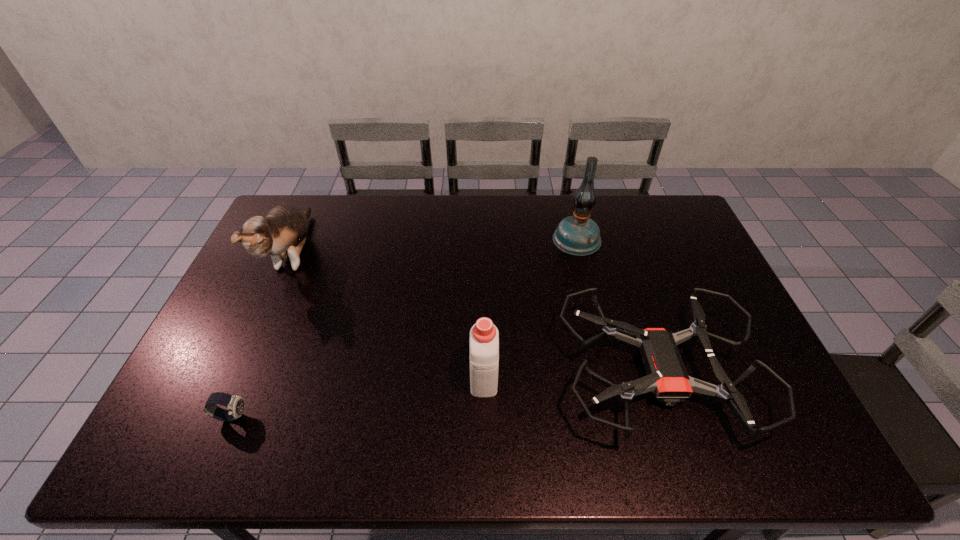
Where is `watch located in the left edge section of the desktop`? The width and height of the screenshot is (960, 540). watch located in the left edge section of the desktop is located at coordinates (235, 404).

I want to click on object at the right edge, so click(x=667, y=378).

Identify the location of object present at the far left corner. The height and width of the screenshot is (540, 960). (282, 232).

Locate an element on the screen. The height and width of the screenshot is (540, 960). object located at the near left corner is located at coordinates tap(235, 404).

Find the location of a particular element. This screenshot has width=960, height=540. object present at the near right corner is located at coordinates (667, 378).

Image resolution: width=960 pixels, height=540 pixels. In order to click on vacant space at the far edge of the desktop in this screenshot , I will do 355,233.

In order to click on vacant area at the near edge of the desktop in this screenshot , I will do [x=392, y=461].

The width and height of the screenshot is (960, 540). What are the coordinates of `free space at the left edge` in the screenshot? It's located at click(x=239, y=333).

Where is `free space at the near left corner of the desktop`? The width and height of the screenshot is (960, 540). free space at the near left corner of the desktop is located at coordinates (210, 431).

Locate an element on the screen. unoccupied position between the watch and the drone is located at coordinates (444, 395).